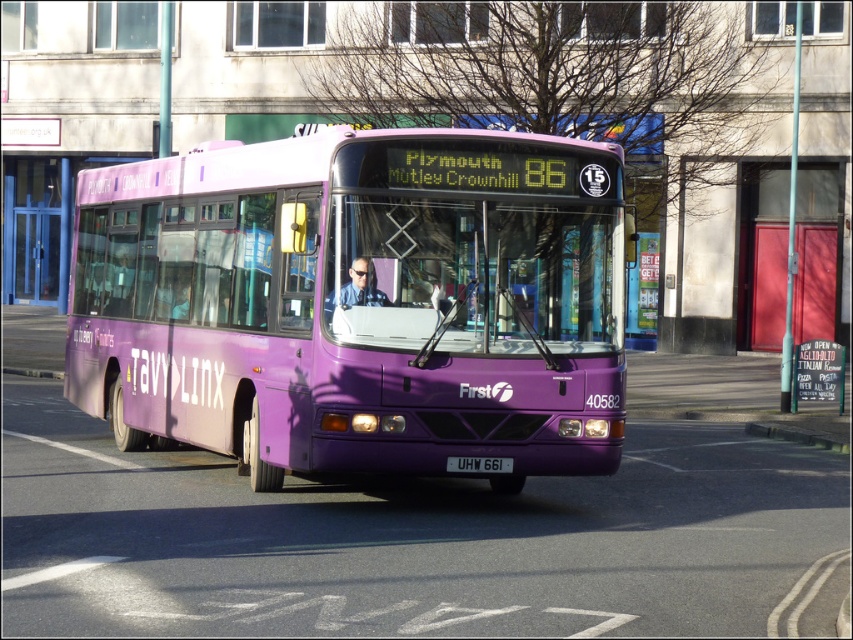
Question: Is the position of matte purple bus at center less distant than that of black plastic license plate at center?

Choices:
 (A) no
 (B) yes

Answer: (A)

Question: Is matte purple bus at center positioned in front of purple rubber curb at lower center?

Choices:
 (A) yes
 (B) no

Answer: (A)

Question: Is purple rubber curb at lower center positioned in front of black plastic license plate at center?

Choices:
 (A) no
 (B) yes

Answer: (A)

Question: Which object is positioned farthest from the purple rubber curb at lower center?

Choices:
 (A) matte purple bus at center
 (B) black plastic license plate at center

Answer: (B)

Question: Based on their relative distances, which object is farther from the purple rubber curb at lower center?

Choices:
 (A) black plastic license plate at center
 (B) matte purple bus at center

Answer: (A)

Question: Which point is closer to the camera?

Choices:
 (A) (445, 464)
 (B) (769, 428)

Answer: (A)